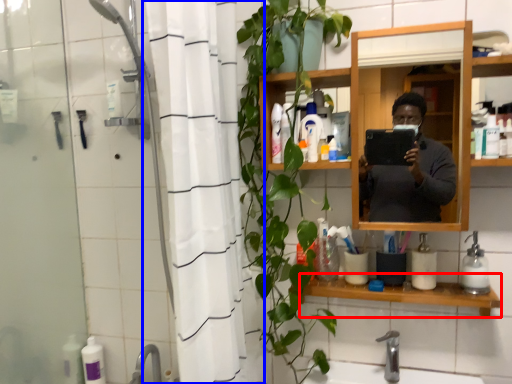
Question: Which object appears closest to the camera in this image, shelve (highlighted by a red box) or shower curtain (highlighted by a blue box)?

Choices:
 (A) shelve
 (B) shower curtain

Answer: (B)